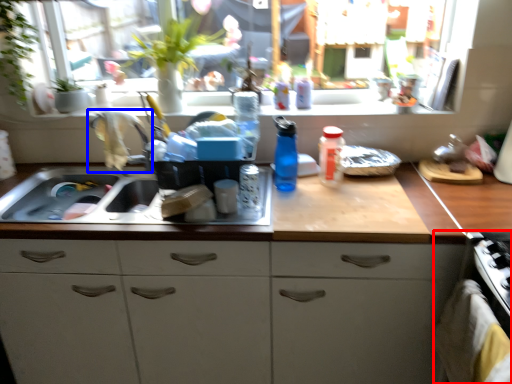
Question: Among these objects, which one is farthest to the camera, oven (highlighted by a red box) or faucet (highlighted by a blue box)?

Choices:
 (A) oven
 (B) faucet

Answer: (B)